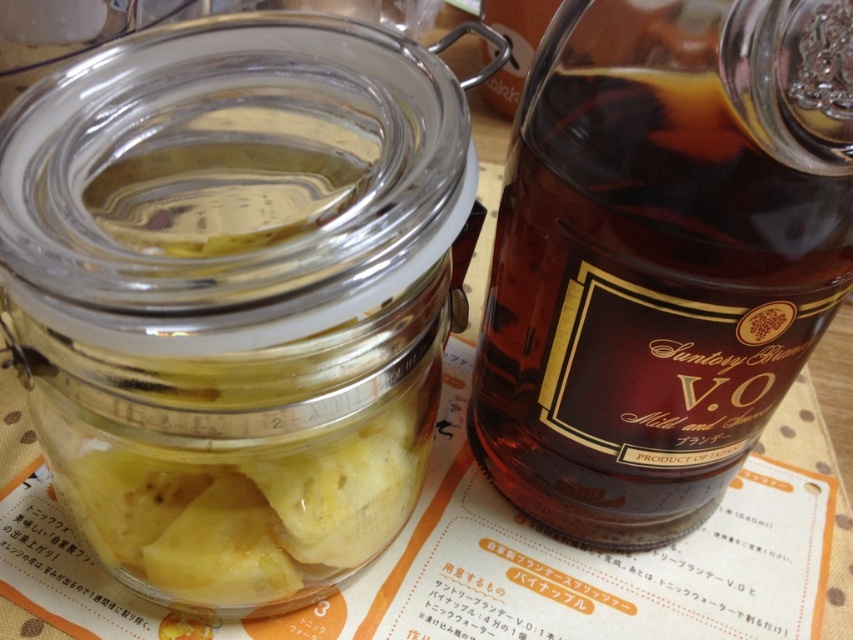
You are setting up a display for a cocktail bar. You have a transparent glass jar at left and a brown glass bottle at right. According to the image, which object is positioned higher on the table?

The transparent glass jar at left is located above the brown glass bottle at right, so it is positioned higher on the table.

You are setting up a display for a cocktail party and need to place the transparent glass jar at left and the brown glass bottle at right. If you want to ensure that both items are visible from the front of the display, which item should you adjust to make space for the other?

The transparent glass jar at left is in front of the brown glass bottle at right, so you should move the transparent glass jar at left backward to make the brown glass bottle at right more visible from the front.

You are a bartender preparing a drink that requires a tall container. You have the transparent glass jar at left and the brown glass bottle at right available. Which one should you choose based on their height?

The transparent glass jar at left is much taller than the brown glass bottle at right, so you should choose the transparent glass jar at left for the drink preparation.